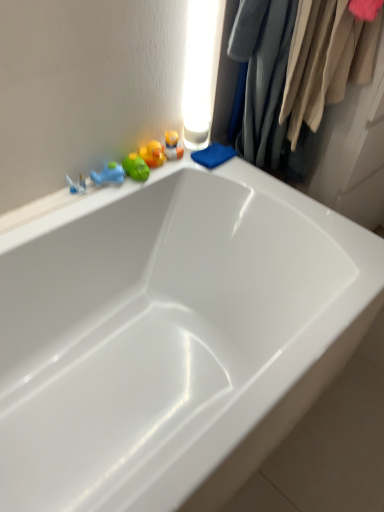
Question: Considering the relative sizes of translucent plastic toys at upper left, acting as the 3th toy starting from the left, and rubber duck at upper left, which is the second toy from left to right, in the image provided, is translucent plastic toys at upper left, acting as the 3th toy starting from the left, smaller than rubber duck at upper left, which is the second toy from left to right,?

Choices:
 (A) yes
 (B) no

Answer: (B)

Question: Does translucent plastic toys at upper left, the 1th toy viewed from the right, come behind rubber duck at upper left, which is the second toy from left to right?

Choices:
 (A) yes
 (B) no

Answer: (A)

Question: Does translucent plastic toys at upper left, the 1th toy viewed from the right, have a greater width compared to rubber duck at upper left, the second toy viewed from the right?

Choices:
 (A) no
 (B) yes

Answer: (B)

Question: Is translucent plastic toys at upper left, the 1th toy viewed from the right, not near rubber duck at upper left, which is the second toy from left to right?

Choices:
 (A) yes
 (B) no

Answer: (B)

Question: Could you tell me if translucent plastic toys at upper left, acting as the 3th toy starting from the left, is facing rubber duck at upper left, the second toy viewed from the right?

Choices:
 (A) no
 (B) yes

Answer: (A)

Question: Considering their positions, is white glossy bathtub at upper center located in front of or behind green rubber duck at upper left, the third toy positioned from the right?

Choices:
 (A) behind
 (B) front

Answer: (B)

Question: From the image's perspective, is white glossy bathtub at upper center above or below green rubber duck at upper left, which is the first toy from left to right?

Choices:
 (A) below
 (B) above

Answer: (A)

Question: In terms of height, does white glossy bathtub at upper center look taller or shorter compared to green rubber duck at upper left, the third toy positioned from the right?

Choices:
 (A) short
 (B) tall

Answer: (B)

Question: Choose the correct answer: Is white glossy bathtub at upper center inside green rubber duck at upper left, which is the first toy from left to right, or outside it?

Choices:
 (A) outside
 (B) inside

Answer: (A)

Question: Based on their sizes in the image, would you say velvet fabric clothes at upper right is bigger or smaller than green rubber duck at upper left, which is the first toy from left to right?

Choices:
 (A) big
 (B) small

Answer: (A)

Question: Is velvet fabric clothes at upper right taller or shorter than green rubber duck at upper left, the third toy positioned from the right?

Choices:
 (A) short
 (B) tall

Answer: (B)

Question: Considering the positions of point (286, 61) and point (135, 159), is point (286, 61) closer or farther from the camera than point (135, 159)?

Choices:
 (A) closer
 (B) farther

Answer: (A)

Question: From a real-world perspective, relative to green rubber duck at upper left, which is the first toy from left to right, is velvet fabric clothes at upper right vertically above or below?

Choices:
 (A) above
 (B) below

Answer: (A)

Question: Considering the positions of green rubber duck at upper left, which is the first toy from left to right, and translucent plastic toys at upper left, the 1th toy viewed from the right, in the image, is green rubber duck at upper left, which is the first toy from left to right, taller or shorter than translucent plastic toys at upper left, the 1th toy viewed from the right,?

Choices:
 (A) tall
 (B) short

Answer: (B)

Question: Considering the positions of green rubber duck at upper left, the third toy positioned from the right, and translucent plastic toys at upper left, acting as the 3th toy starting from the left, in the image, is green rubber duck at upper left, the third toy positioned from the right, wider or thinner than translucent plastic toys at upper left, acting as the 3th toy starting from the left,?

Choices:
 (A) thin
 (B) wide

Answer: (A)